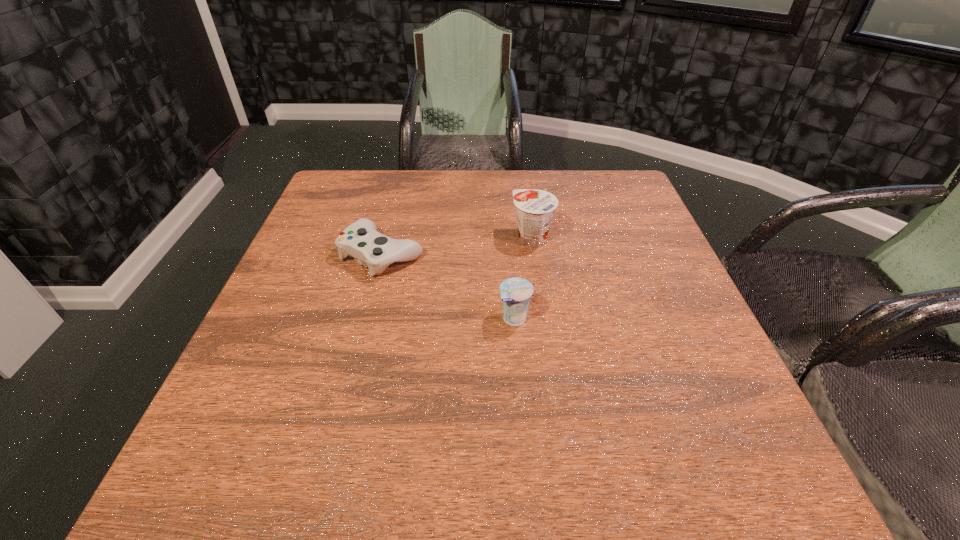
Image resolution: width=960 pixels, height=540 pixels. Find the location of `blank space that satisfies the following two spatial constraints: 1. on the back side of the taller yogurt; 2. on the left side of the nearest object`. blank space that satisfies the following two spatial constraints: 1. on the back side of the taller yogurt; 2. on the left side of the nearest object is located at coordinates (508, 239).

Find the location of `vacant point that satisfies the following two spatial constraints: 1. on the back side of the taller yogurt; 2. on the right side of the second tallest object`. vacant point that satisfies the following two spatial constraints: 1. on the back side of the taller yogurt; 2. on the right side of the second tallest object is located at coordinates coord(508,239).